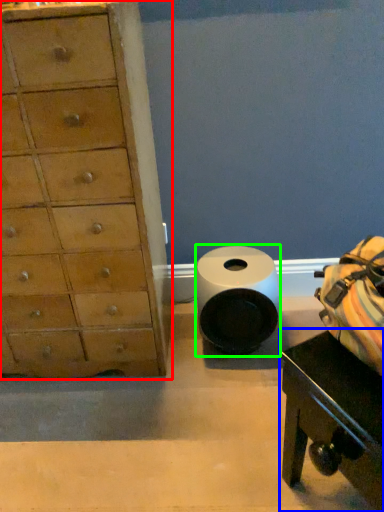
Question: Based on their relative distances, which object is nearer to chest of drawers (highlighted by a red box)? Choose from table (highlighted by a blue box) and toilet paper (highlighted by a green box).

Choices:
 (A) table
 (B) toilet paper

Answer: (B)